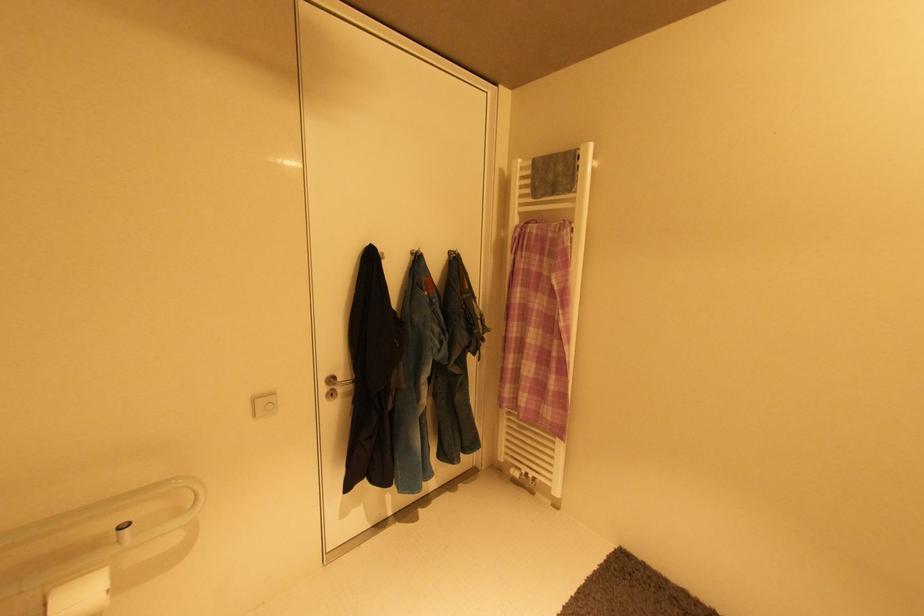
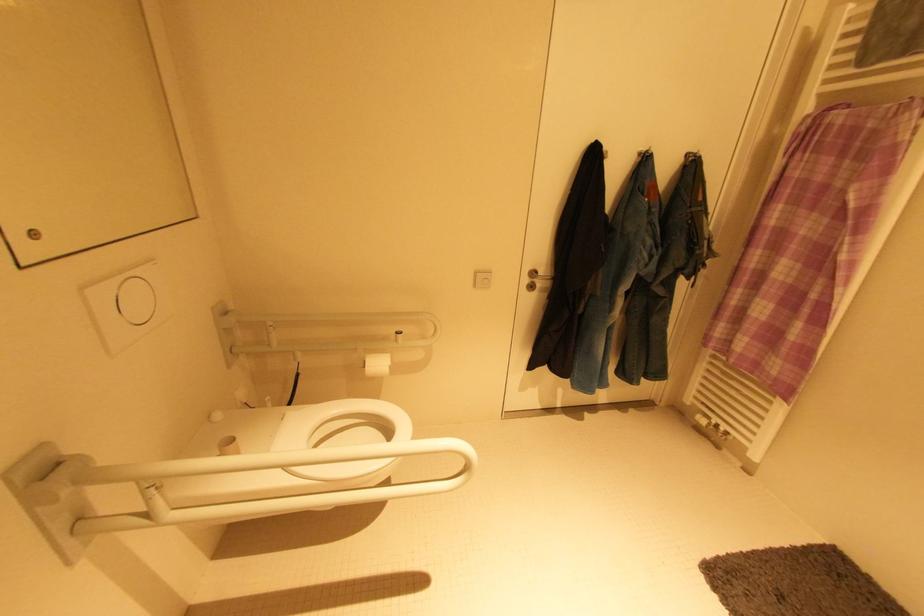
Question: The camera is either moving clockwise (left) or counter-clockwise (right) around the object. The first image is from the beginning of the video and the second image is from the end. Is the camera moving left or right when shooting the video?

Choices:
 (A) Left
 (B) Right

Answer: (B)